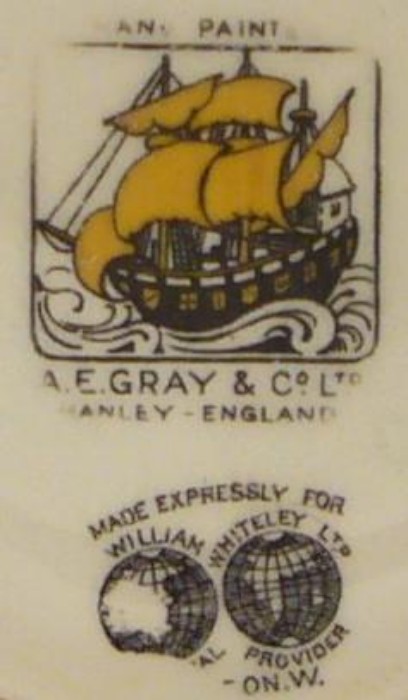
I want to click on the bottom left globe, so click(x=179, y=600).